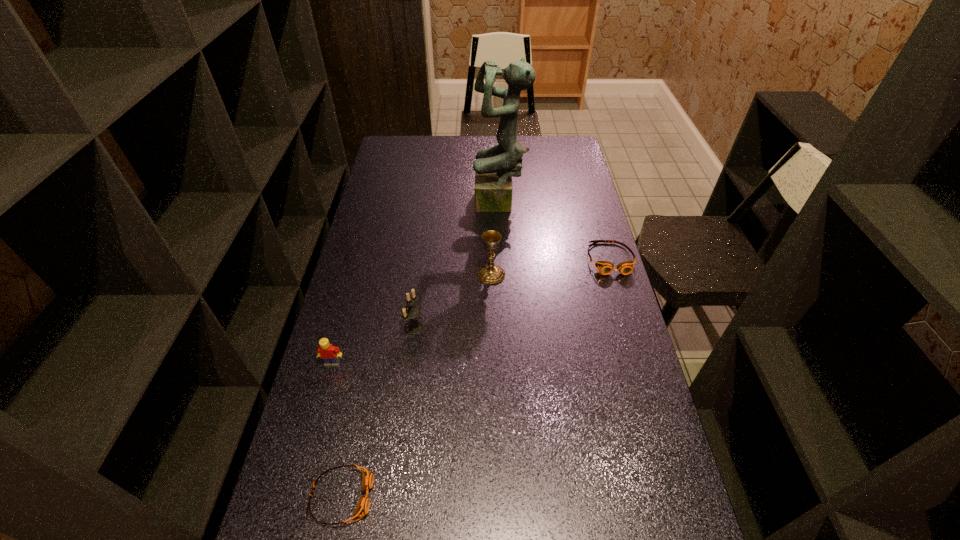
Find the location of a particular element. The width and height of the screenshot is (960, 540). Lego is located at coordinates (330, 354).

This screenshot has width=960, height=540. Identify the location of free space located with the lenses facing forward on the nearest object. (529, 496).

Locate an element on the screen. vacant space located with the lenses facing forward on the rightmost object is located at coordinates (638, 356).

What are the coordinates of `free spot located 0.140m on the face of the tallest object` in the screenshot? It's located at (439, 205).

Identify the location of free location located 0.350m on the face of the tallest object. (386, 205).

The height and width of the screenshot is (540, 960). I want to click on free space located on the face of the tallest object, so click(386, 205).

Locate an element on the screen. vacant space located on the front of the fourth farthest object is located at coordinates (408, 373).

Find the location of a particular element. The image size is (960, 540). blank space located 0.150m on the right of the chalice is located at coordinates (549, 274).

Locate an element on the screen. The image size is (960, 540). vacant space located 0.350m on the front-facing side of the second nearest object is located at coordinates (296, 500).

Identify the location of object that is at the near edge. The image size is (960, 540). (362, 508).